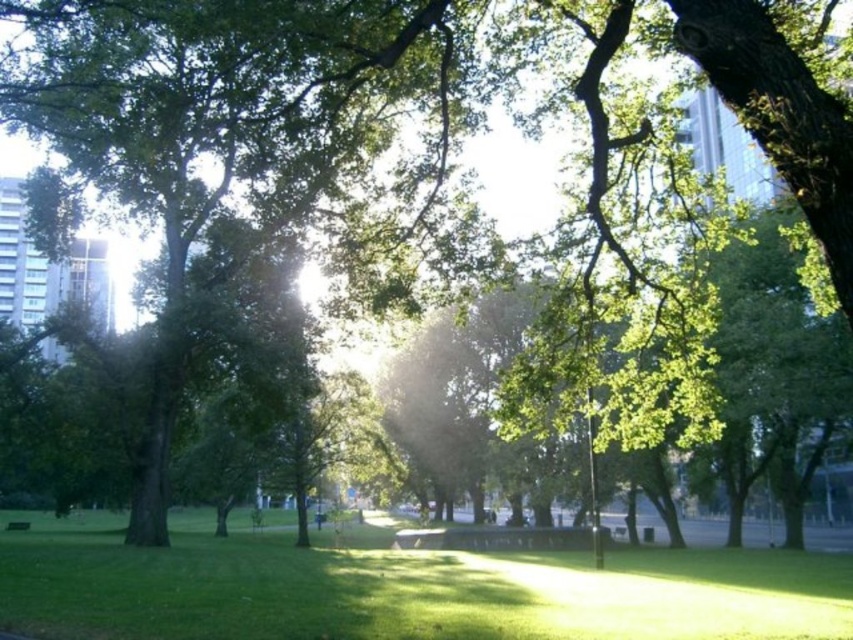
You are standing at the camera position and want to place a small bench between the two points, point (445, 592) and point (10, 525). Which point should the bench be closer to in order to be nearer to the camera?

The bench should be closer to point (445, 592) because it is closer to the camera than point (10, 525).